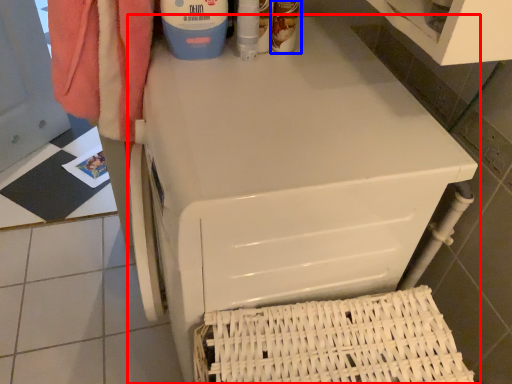
Question: Among these objects, which one is farthest to the camera, home appliance (highlighted by a red box) or cleaning product (highlighted by a blue box)?

Choices:
 (A) home appliance
 (B) cleaning product

Answer: (B)